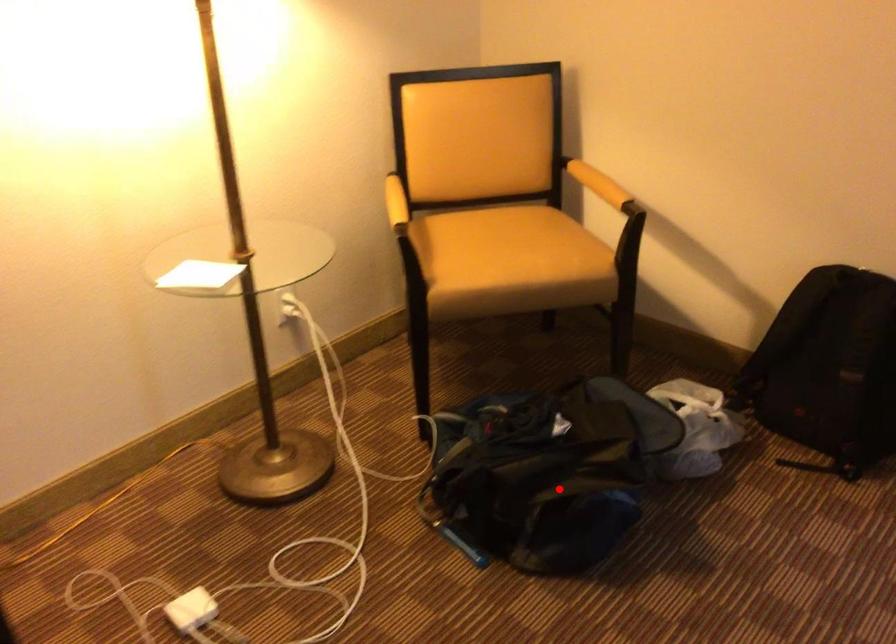
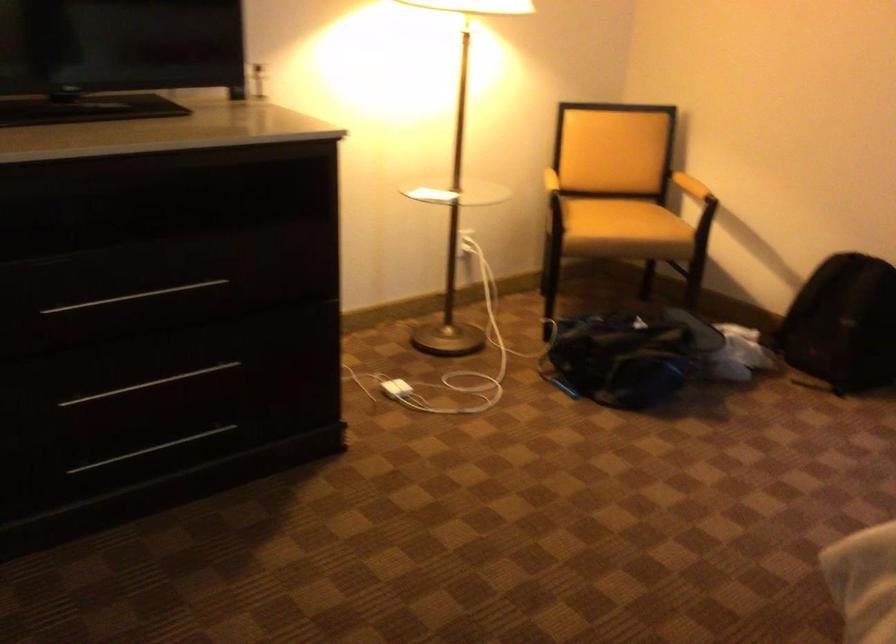
Question: I am providing you with two images of the same scene from different viewpoints. In image1, a red point is highlighted. Considering the same 3D point in image2, which of the following is correct?

Choices:
 (A) It is closer
 (B) It is farther

Answer: (B)